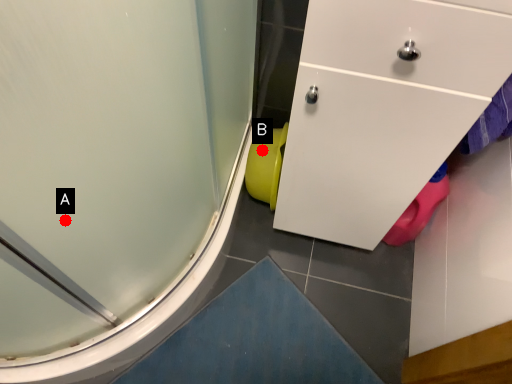
Question: Two points are circled on the image, labeled by A and B beside each circle. Which point is farther to the camera?

Choices:
 (A) A is further
 (B) B is further

Answer: (B)